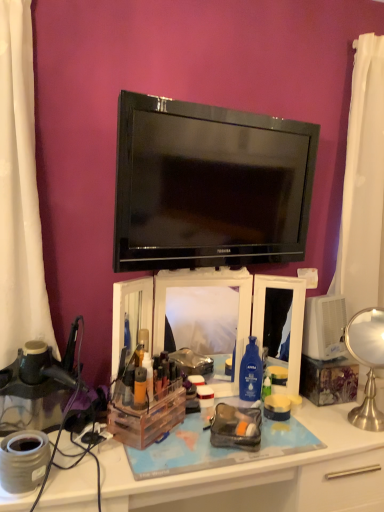
Question: Is the depth of translucent plastic container at center, placed as the 1th toiletry when sorted from back to front, greater than that of black glossy tv at center?

Choices:
 (A) no
 (B) yes

Answer: (B)

Question: Does translucent plastic container at center, placed as the 1th toiletry when sorted from back to front, have a larger size compared to black glossy tv at center?

Choices:
 (A) no
 (B) yes

Answer: (A)

Question: Is black glossy tv at center inside translucent plastic container at center, placed as the 1th toiletry when sorted from back to front?

Choices:
 (A) no
 (B) yes

Answer: (A)

Question: Is translucent plastic container at center, the second toiletry viewed from the front, positioned before black glossy tv at center?

Choices:
 (A) no
 (B) yes

Answer: (A)

Question: Considering the relative sizes of translucent plastic container at center, placed as the 1th toiletry when sorted from back to front, and black glossy tv at center in the image provided, is translucent plastic container at center, placed as the 1th toiletry when sorted from back to front, shorter than black glossy tv at center?

Choices:
 (A) no
 (B) yes

Answer: (B)

Question: Considering the relative positions of clear plastic organizer at center and clear plastic makeup organizer at center in the image provided, is clear plastic organizer at center to the left or to the right of clear plastic makeup organizer at center?

Choices:
 (A) right
 (B) left

Answer: (B)

Question: Considering the positions of point (180, 436) and point (160, 351), is point (180, 436) closer or farther from the camera than point (160, 351)?

Choices:
 (A) closer
 (B) farther

Answer: (A)

Question: In terms of width, does clear plastic organizer at center look wider or thinner when compared to clear plastic makeup organizer at center?

Choices:
 (A) wide
 (B) thin

Answer: (A)

Question: Is clear plastic organizer at center taller or shorter than clear plastic makeup organizer at center?

Choices:
 (A) short
 (B) tall

Answer: (B)

Question: Considering the positions of clear plastic makeup organizer at center and matte orange bottle at center, marked as the 2th toiletry in a back-to-front arrangement, in the image, is clear plastic makeup organizer at center taller or shorter than matte orange bottle at center, marked as the 2th toiletry in a back-to-front arrangement,?

Choices:
 (A) tall
 (B) short

Answer: (A)

Question: In terms of width, does clear plastic makeup organizer at center look wider or thinner when compared to matte orange bottle at center, marked as the 2th toiletry in a back-to-front arrangement?

Choices:
 (A) wide
 (B) thin

Answer: (A)

Question: Relative to matte orange bottle at center, which is the first toiletry in front-to-back order, is clear plastic makeup organizer at center in front or behind?

Choices:
 (A) front
 (B) behind

Answer: (B)

Question: From a real-world perspective, is clear plastic makeup organizer at center physically located above or below matte orange bottle at center, which is the first toiletry in front-to-back order?

Choices:
 (A) below
 (B) above

Answer: (B)

Question: Is clear plastic organizer at center spatially inside black glossy tv at center, or outside of it?

Choices:
 (A) inside
 (B) outside

Answer: (B)

Question: Looking at the image, does clear plastic organizer at center seem bigger or smaller compared to black glossy tv at center?

Choices:
 (A) big
 (B) small

Answer: (A)